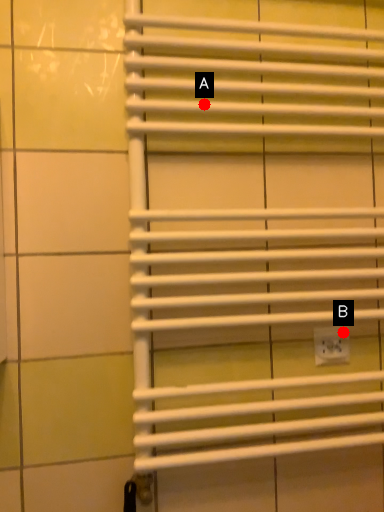
Question: Two points are circled on the image, labeled by A and B beside each circle. Which of the following is the farthest from the observer?

Choices:
 (A) A is further
 (B) B is further

Answer: (B)